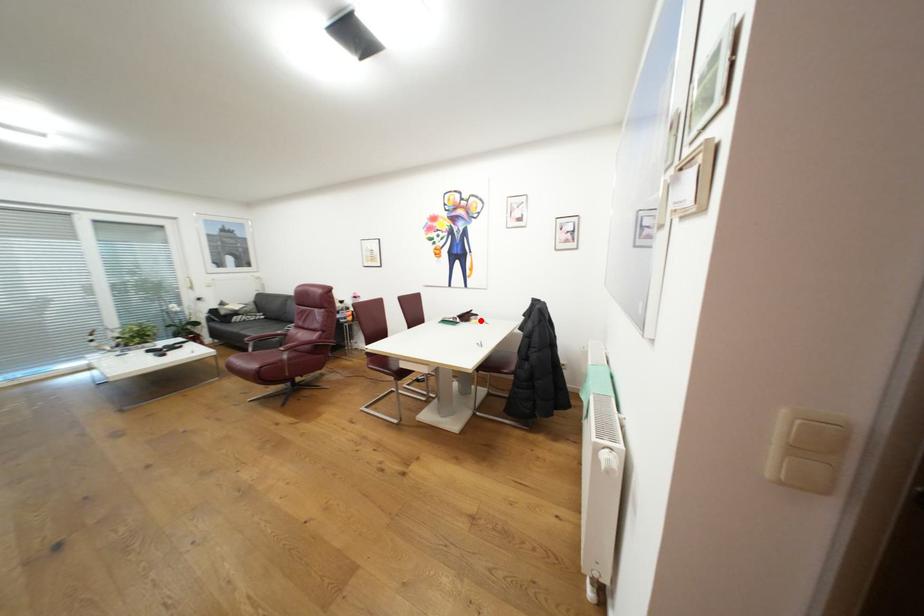
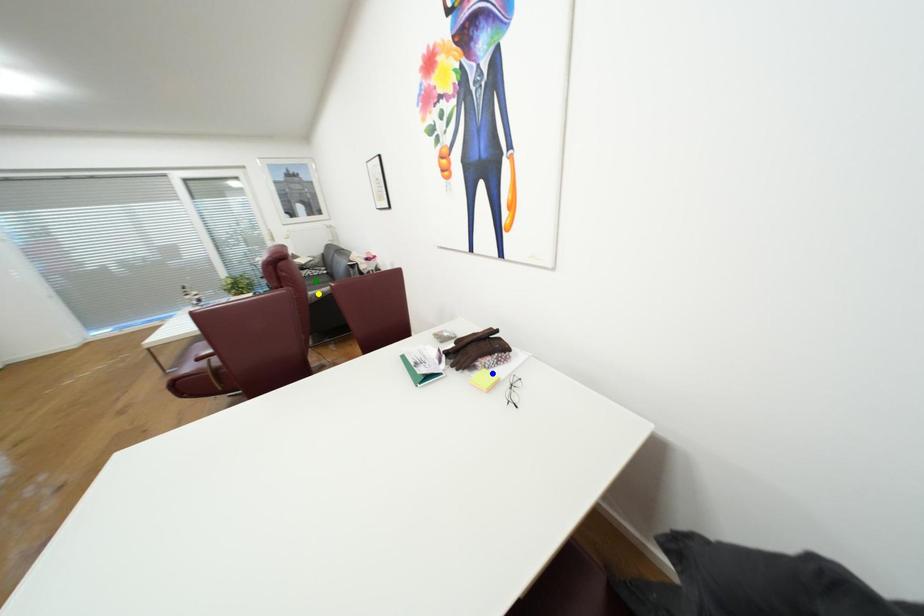
Question: I am providing you with two images of the same scene from different viewpoints. A red point is marked on the first image. You are given multiple points on the second image. Which spot in image 2 lines up with the point in image 1?

Choices:
 (A) green point
 (B) yellow point
 (C) blue point

Answer: (C)